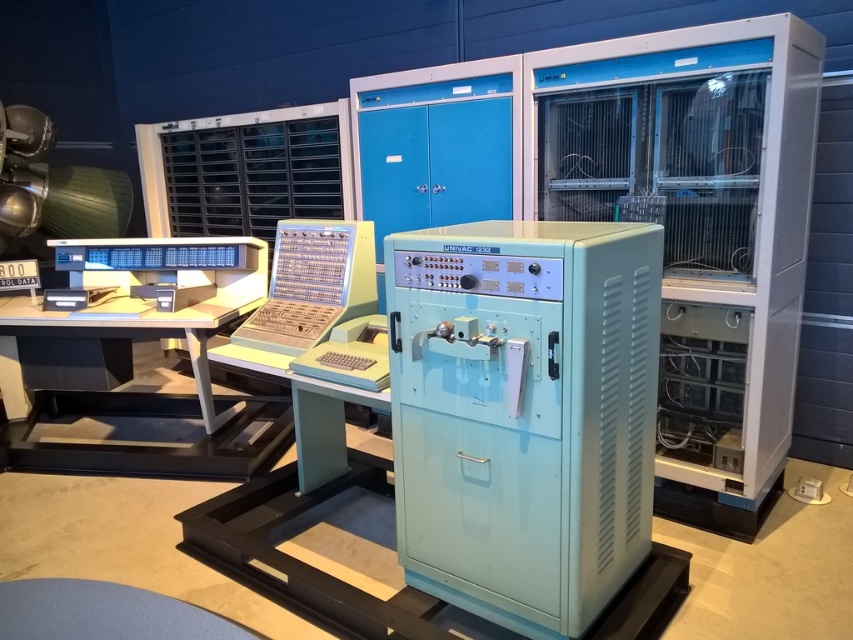
You are a museum visitor standing in front of the vintage computing equipment. The light blue plastic univac 1502 at center is part of an interactive exhibit. If you want to touch the univac 1502, will you be able to reach it without moving closer than your current position?

The light blue plastic univac 1502 at center is 5.29 feet from the camera. Since the average person can reach about 2 feet in front of themselves, you would need to move closer to touch it.

You are a museum curator arranging an exhibit and need to place a small decorative plaque between the light blue plastic univac 1502 at center and the yellow plastic keyboard at center. Based on their positions, where should the plaque be placed?

The plaque should be placed below the yellow plastic keyboard at center since the light blue plastic univac 1502 at center is positioned under it, meaning the keyboard is above the univac 1502.